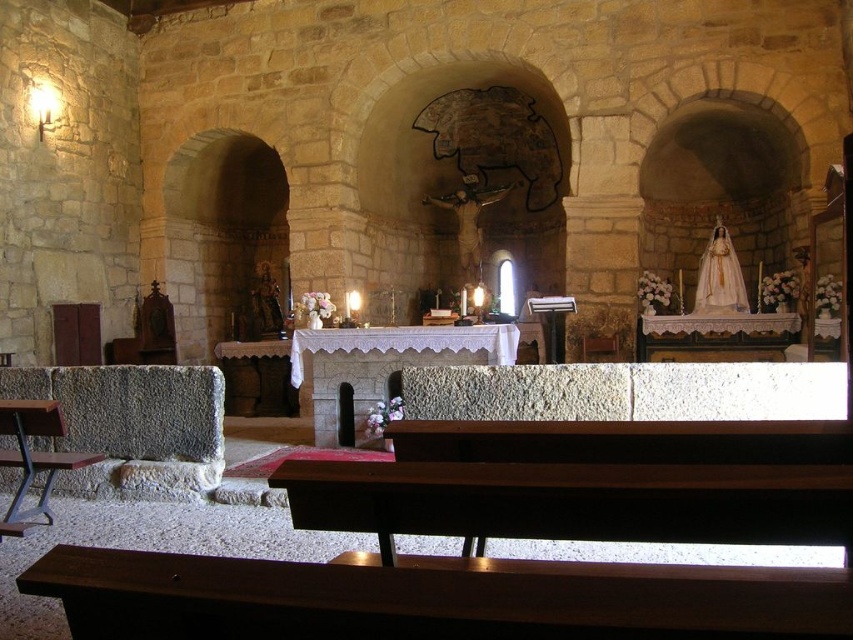
Which is in front, point (585, 492) or point (534, 616)?

Point (534, 616) is more forward.

The image size is (853, 640). Describe the element at coordinates (589, 483) in the screenshot. I see `wooden polished bench at lower center` at that location.

Find the location of a particular element. This screenshot has width=853, height=640. wooden polished bench at lower center is located at coordinates (589, 483).

Can you confirm if smooth brown wood at lower center is thinner than white stone altar at center?

Yes.

Does smooth brown wood at lower center have a smaller size compared to white stone altar at center?

Correct, smooth brown wood at lower center occupies less space than white stone altar at center.

Identify the location of smooth brown wood at lower center. (431, 600).

Consider the image. Can you confirm if wooden polished bench at lower center is wider than white stone altar at center?

Incorrect, wooden polished bench at lower center's width does not surpass white stone altar at center's.

Is wooden polished bench at lower center closer to the viewer compared to white stone altar at center?

Yes.

Who is more forward, (721, 504) or (357, 410)?

Point (721, 504)

This screenshot has height=640, width=853. In order to click on wooden polished bench at lower center in this screenshot , I will do `click(589, 483)`.